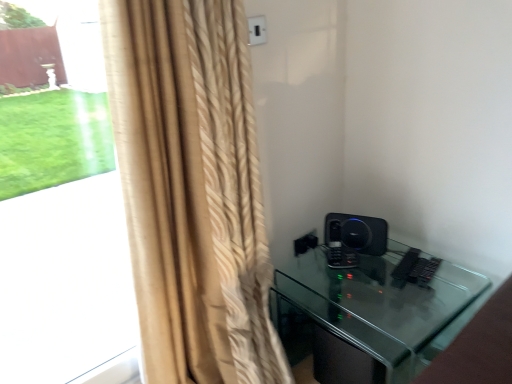
Question: From the image's perspective, would you say beige textured curtain at left is positioned over black matte speaker at right?

Choices:
 (A) yes
 (B) no

Answer: (A)

Question: Is beige textured curtain at left looking in the opposite direction of black matte speaker at right?

Choices:
 (A) yes
 (B) no

Answer: (B)

Question: Does beige textured curtain at left touch black matte speaker at right?

Choices:
 (A) no
 (B) yes

Answer: (A)

Question: Does beige textured curtain at left lie behind black matte speaker at right?

Choices:
 (A) no
 (B) yes

Answer: (A)

Question: Is beige textured curtain at left far away from black matte speaker at right?

Choices:
 (A) yes
 (B) no

Answer: (B)

Question: Does beige textured curtain at left have a smaller size compared to black matte speaker at right?

Choices:
 (A) no
 (B) yes

Answer: (A)

Question: From the image's perspective, does black glass table at lower right appear lower than black matte speaker at right?

Choices:
 (A) no
 (B) yes

Answer: (B)

Question: Is black glass table at lower right in front of black matte speaker at right?

Choices:
 (A) no
 (B) yes

Answer: (B)

Question: Is black glass table at lower right not near black matte speaker at right?

Choices:
 (A) yes
 (B) no

Answer: (B)

Question: From a real-world perspective, is black glass table at lower right located beneath black matte speaker at right?

Choices:
 (A) no
 (B) yes

Answer: (B)

Question: Does black glass table at lower right appear on the right side of black matte speaker at right?

Choices:
 (A) yes
 (B) no

Answer: (A)

Question: Is black glass table at lower right shorter than black matte speaker at right?

Choices:
 (A) yes
 (B) no

Answer: (B)

Question: Is beige textured curtain at left not near black glass table at lower right?

Choices:
 (A) no
 (B) yes

Answer: (B)